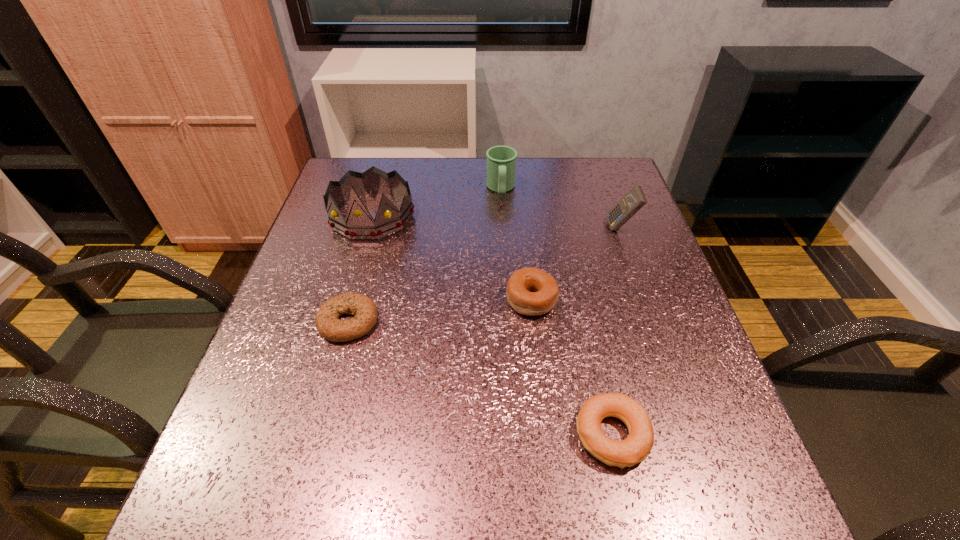
Find the location of a particular element. free space that satisfies the following two spatial constraints: 1. at the front of the leftmost bagel with jewels; 2. on the left side of the tallest object is located at coordinates (342, 322).

Where is `free space in the image that satisfies the following two spatial constraints: 1. at the front of the tallest object with jewels; 2. on the left side of the nearest object`? free space in the image that satisfies the following two spatial constraints: 1. at the front of the tallest object with jewels; 2. on the left side of the nearest object is located at coordinates (309, 435).